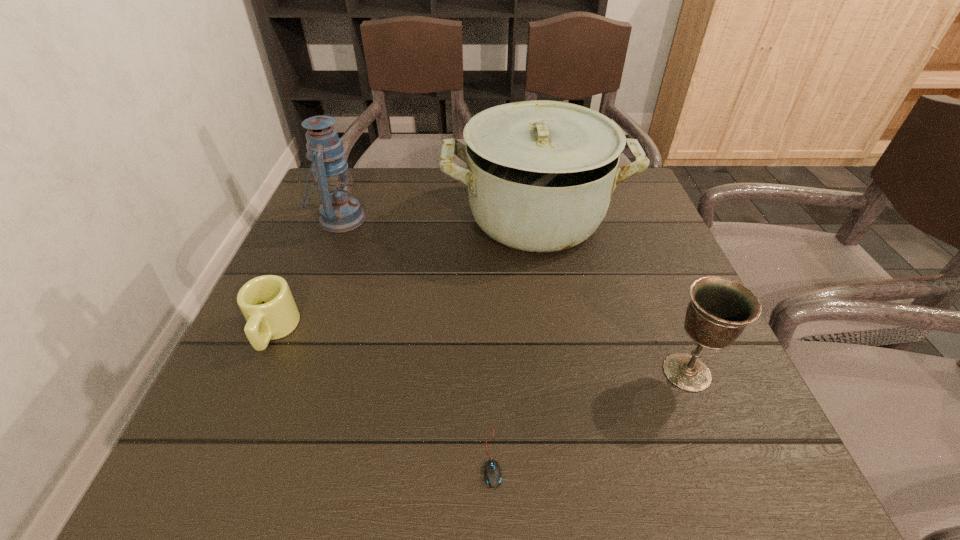
Find the location of a particular element. The width and height of the screenshot is (960, 540). lantern is located at coordinates (339, 212).

At what (x,y) coordinates should I click in order to perform the action: click on saucepan. Please return your answer as a coordinate pair (x, y). Looking at the image, I should click on (540, 174).

The image size is (960, 540). Identify the location of the third tallest object. (719, 310).

Locate an element on the screen. The height and width of the screenshot is (540, 960). the fourth tallest object is located at coordinates (266, 302).

I want to click on the shortest object, so click(x=492, y=475).

Locate an element on the screen. The height and width of the screenshot is (540, 960). mouse is located at coordinates (492, 475).

In order to click on free point located on the front-facing side of the lantern in this screenshot , I will do `click(485, 219)`.

Where is `vacant space located on the front of the saucepan`? vacant space located on the front of the saucepan is located at coordinates (551, 315).

The height and width of the screenshot is (540, 960). I want to click on blank area located on the left of the chalice, so pyautogui.click(x=629, y=372).

The height and width of the screenshot is (540, 960). Find the location of `vacant space located with the handle on the side of the mug`. vacant space located with the handle on the side of the mug is located at coordinates (210, 473).